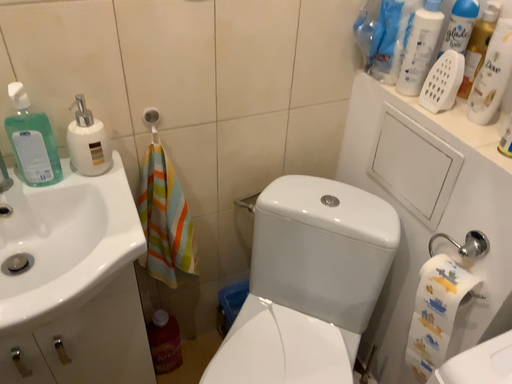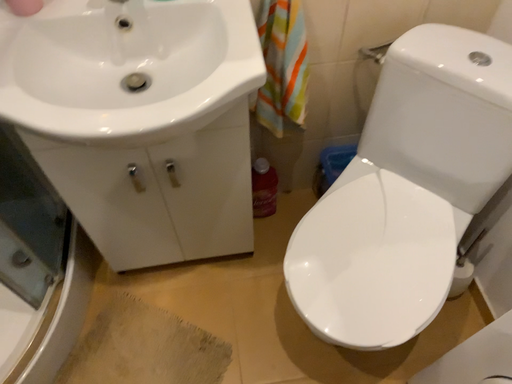
Question: How did the camera likely rotate when shooting the video?

Choices:
 (A) rotated downward
 (B) rotated upward

Answer: (A)